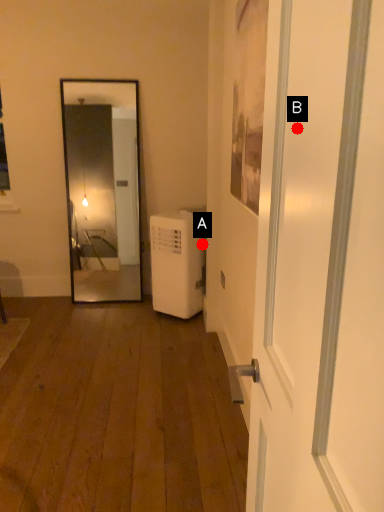
Question: Two points are circled on the image, labeled by A and B beside each circle. Among these points, which one is farthest from the camera?

Choices:
 (A) A is further
 (B) B is further

Answer: (A)